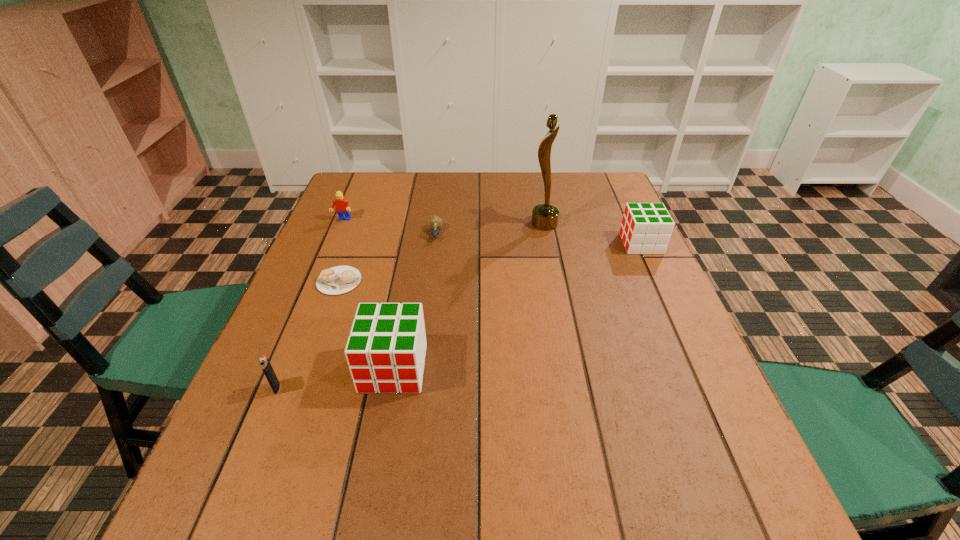
The width and height of the screenshot is (960, 540). Find the location of `vacant space located on the right of the fifth farthest object`. vacant space located on the right of the fifth farthest object is located at coordinates (405, 281).

I want to click on free location located on the back of the igniter, so click(x=331, y=256).

Image resolution: width=960 pixels, height=540 pixels. I want to click on Lego positioned at the left edge, so click(342, 208).

Where is `cappuccino located at the left edge`? cappuccino located at the left edge is located at coordinates coord(337,280).

You are a GUI agent. You are given a task and a screenshot of the screen. Output one action in this format:
    pyautogui.click(x=<x>, y=<y>)
    Task: Click on the igniter located at the left edge
    
    Given the screenshot: What is the action you would take?
    pyautogui.click(x=264, y=362)

At what (x,y) coordinates should I click in order to perform the action: click on object located in the right edge section of the desktop. Please return your answer as a coordinate pair (x, y). The width and height of the screenshot is (960, 540). Looking at the image, I should click on (646, 228).

The image size is (960, 540). I want to click on vacant space at the far edge, so click(429, 187).

The image size is (960, 540). Find the location of `blank space at the left edge of the desktop`. blank space at the left edge of the desktop is located at coordinates (297, 303).

At what (x,y) coordinates should I click in order to perform the action: click on blank area at the right edge. Please return your answer as a coordinate pair (x, y). Looking at the image, I should click on (590, 250).

Identify the location of free spot at the near left corner of the desktop. (218, 458).